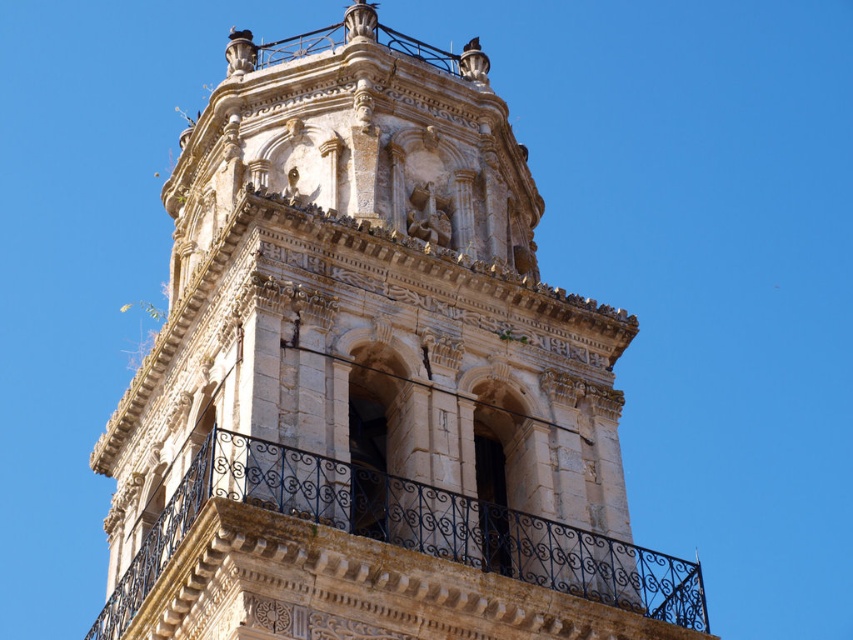
Is white stone tower at center thinner than black wrought iron balcony at center?

No.

This screenshot has width=853, height=640. Find the location of `white stone tower at center`. white stone tower at center is located at coordinates (370, 376).